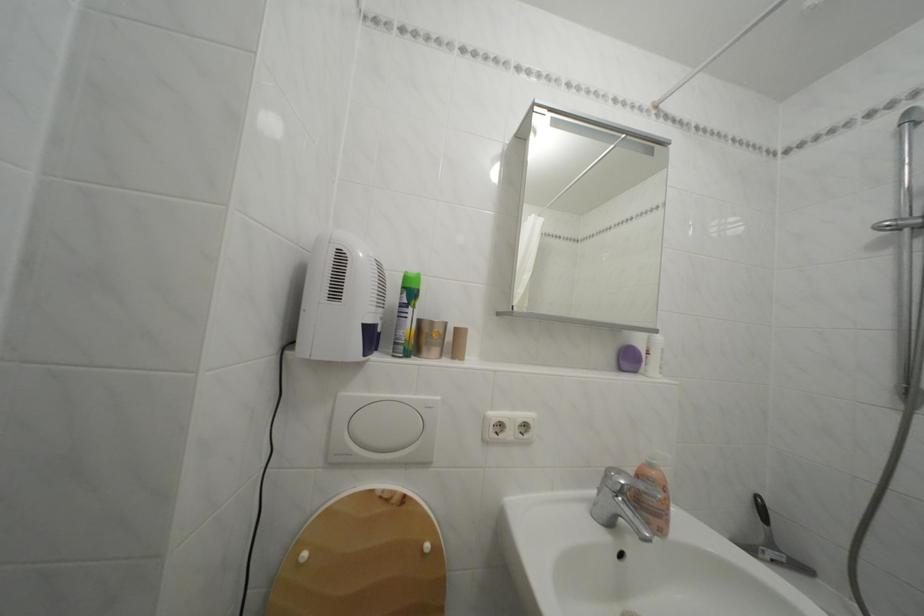
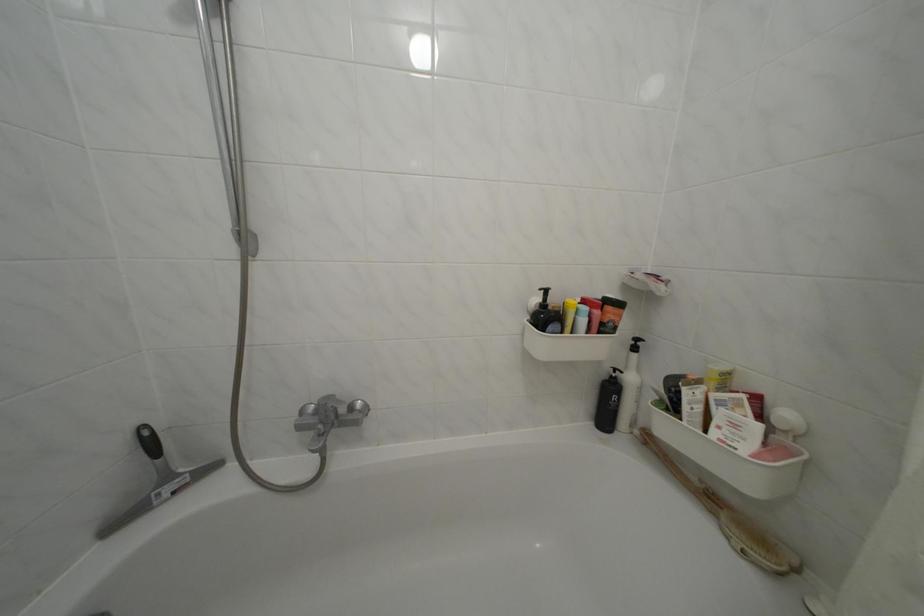
The point at (782, 553) is marked in the first image. Where is the corresponding point in the second image?

(176, 484)